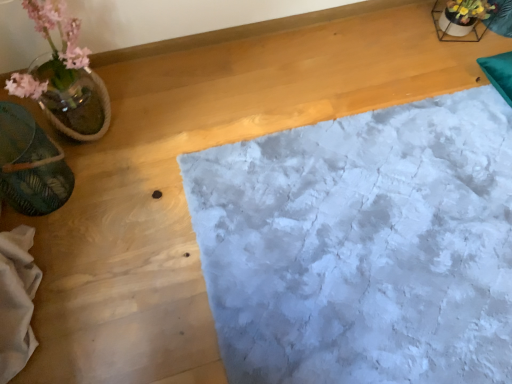
You are a GUI agent. You are given a task and a screenshot of the screen. Output one action in this format:
    pyautogui.click(x=<x>, y=<y>)
    Task: Click on the free space between white textured rug at center and green leafy material at left
    The width and height of the screenshot is (512, 384).
    Given the screenshot: What is the action you would take?
    pyautogui.click(x=162, y=226)